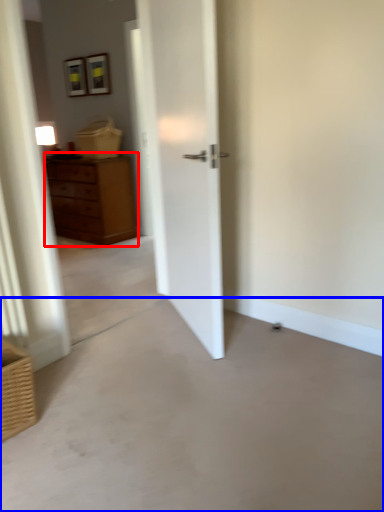
Question: Which point is closer to the camera, chest of drawers (highlighted by a red box) or concrete (highlighted by a blue box)?

Choices:
 (A) chest of drawers
 (B) concrete

Answer: (B)